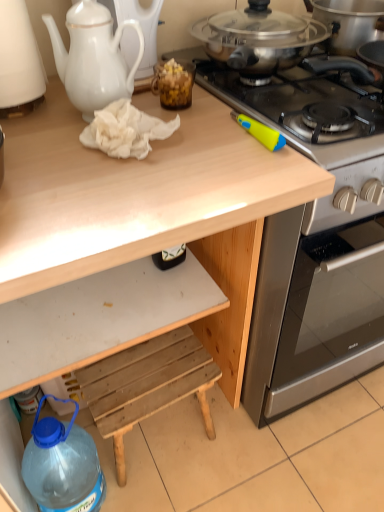
Question: Considering the positions of stainless steel gas stove at upper right and white ceramic teapot at upper left in the image, is stainless steel gas stove at upper right bigger or smaller than white ceramic teapot at upper left?

Choices:
 (A) big
 (B) small

Answer: (A)

Question: Is stainless steel gas stove at upper right wider or thinner than white ceramic teapot at upper left?

Choices:
 (A) wide
 (B) thin

Answer: (A)

Question: Which of these objects is positioned farthest from the white matte drawer at lower center?

Choices:
 (A) stainless steel gas stove at upper right
 (B) stainless steel oven at right
 (C) wooden step stool at lower center
 (D) white ceramic teapot at upper left
 (E) white porcelain teapot at upper left

Answer: (A)

Question: Which object is the closest to the blue translucent bottle at lower left?

Choices:
 (A) white porcelain teapot at upper left
 (B) stainless steel oven at right
 (C) white ceramic teapot at upper left
 (D) translucent brown jar at upper center
 (E) stainless steel gas stove at upper right

Answer: (B)